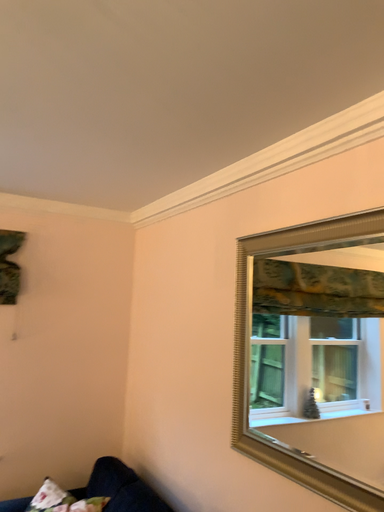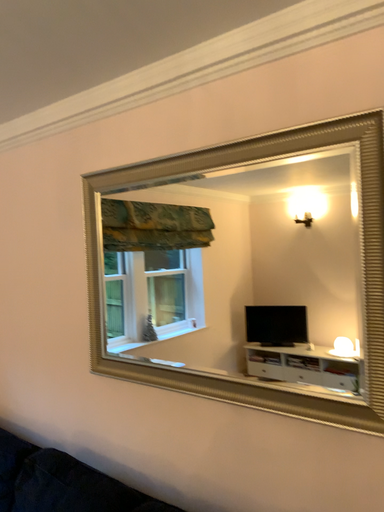
Question: How did the camera likely rotate when shooting the video?

Choices:
 (A) rotated right
 (B) rotated left

Answer: (A)